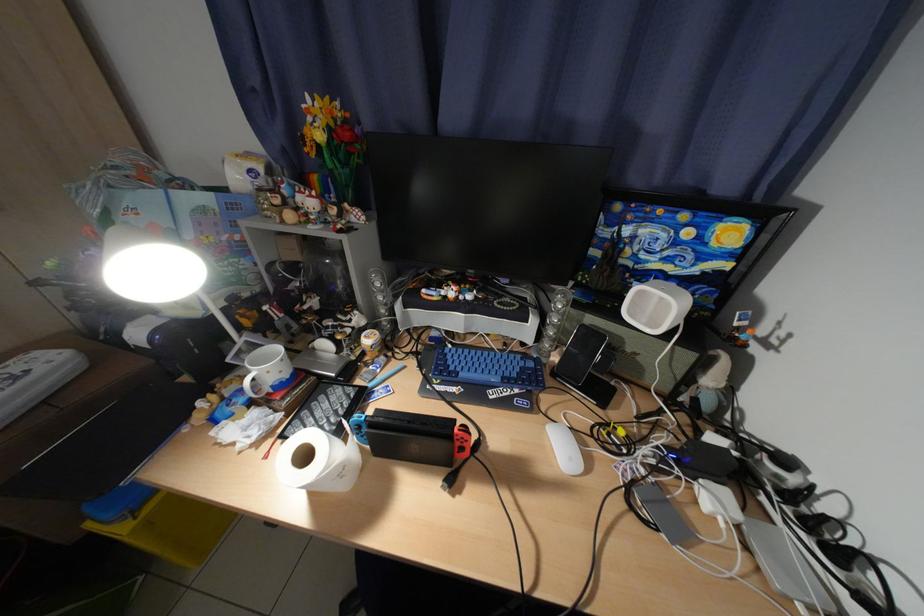
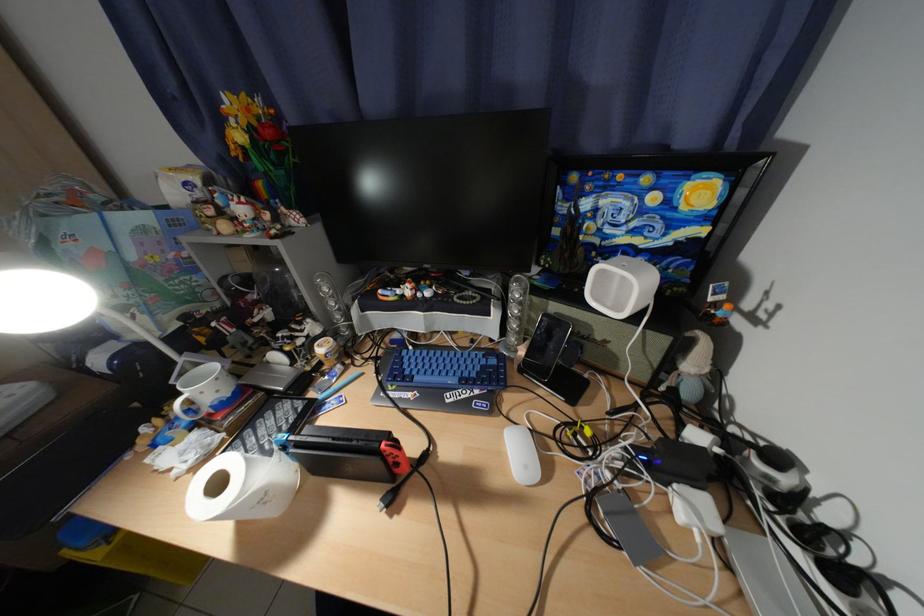
The point at (566, 360) is marked in the first image. Where is the corresponding point in the second image?

(533, 354)